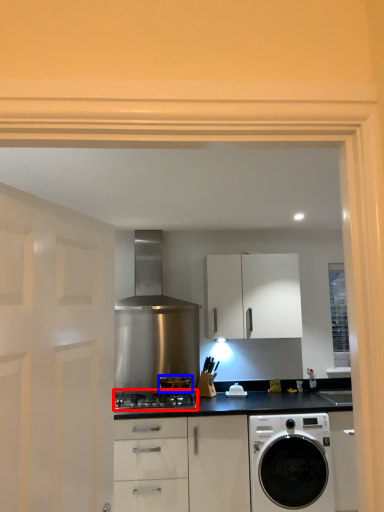
Question: Among these objects, which one is nearest to the camera, gas stove (highlighted by a red box) or kitchen appliance (highlighted by a blue box)?

Choices:
 (A) gas stove
 (B) kitchen appliance

Answer: (A)